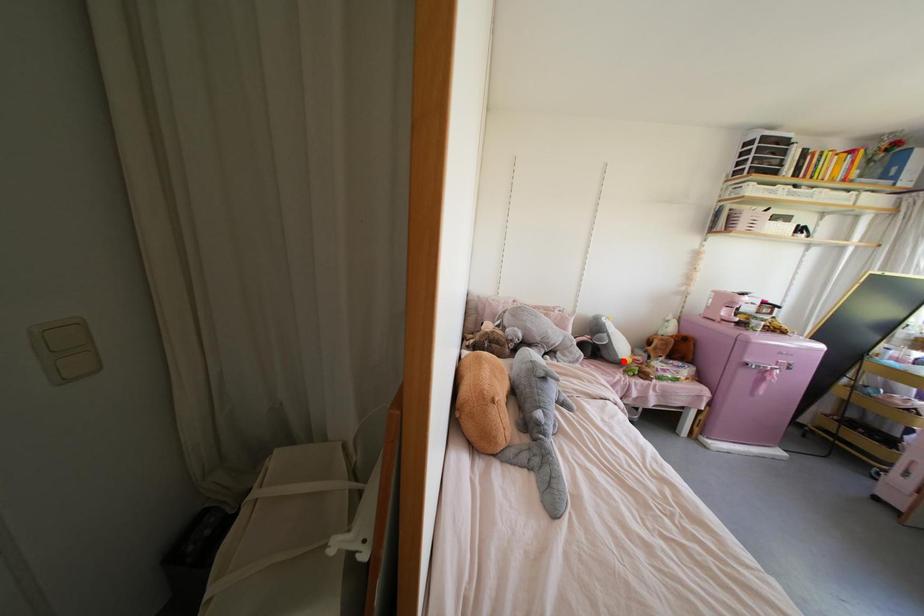
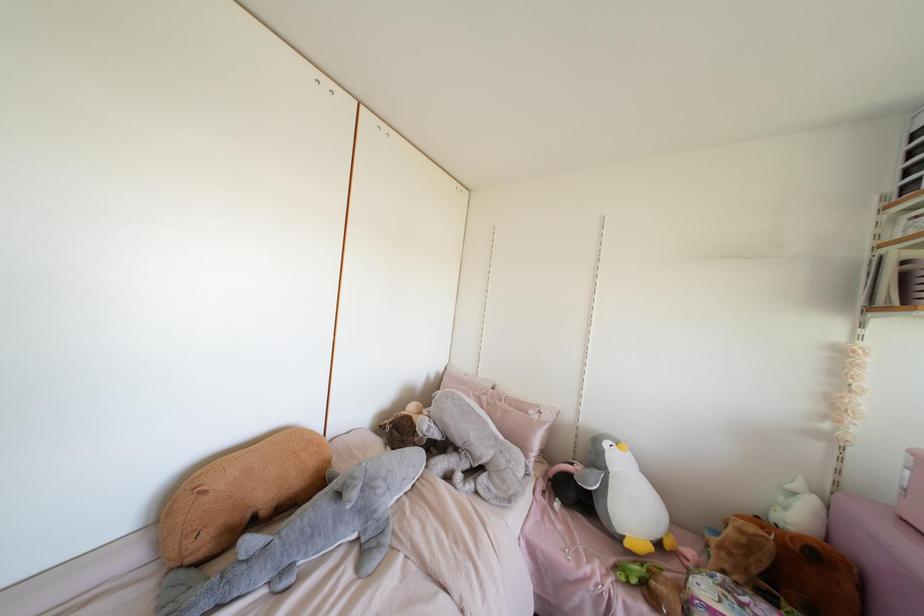
Question: I am providing you with two images of the same scene from different viewpoints. A red point is marked on the first image. Can you still see the location of the red point in image 2?

Choices:
 (A) Yes
 (B) No

Answer: (A)